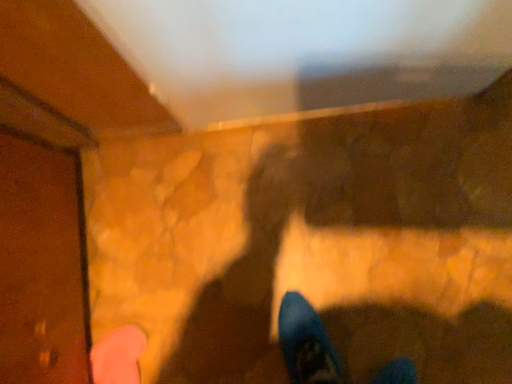
This screenshot has height=384, width=512. In order to click on pink fabric at lower left in this screenshot , I will do `click(118, 356)`.

The height and width of the screenshot is (384, 512). Describe the element at coordinates (118, 356) in the screenshot. I see `pink fabric at lower left` at that location.

I want to click on pink fabric at lower left, so coord(118,356).